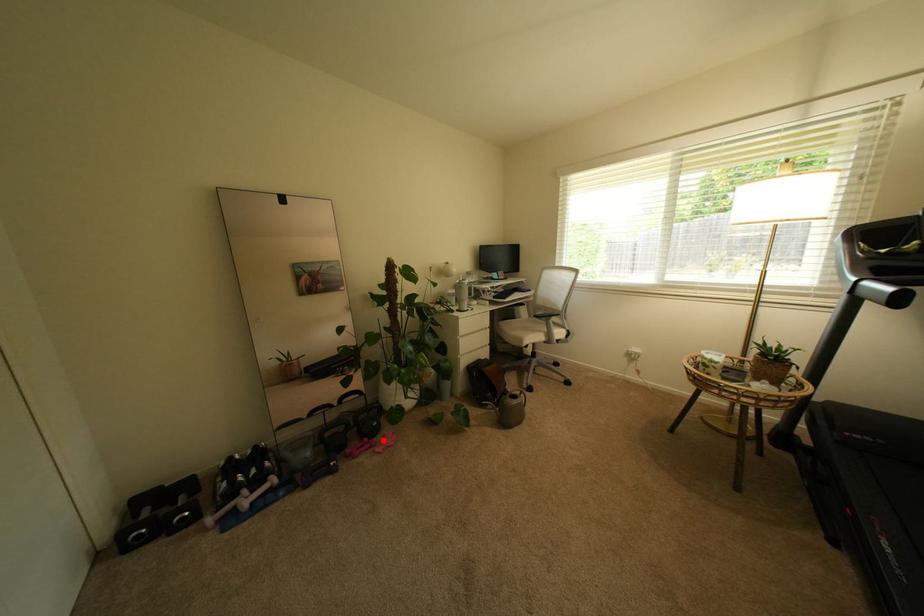
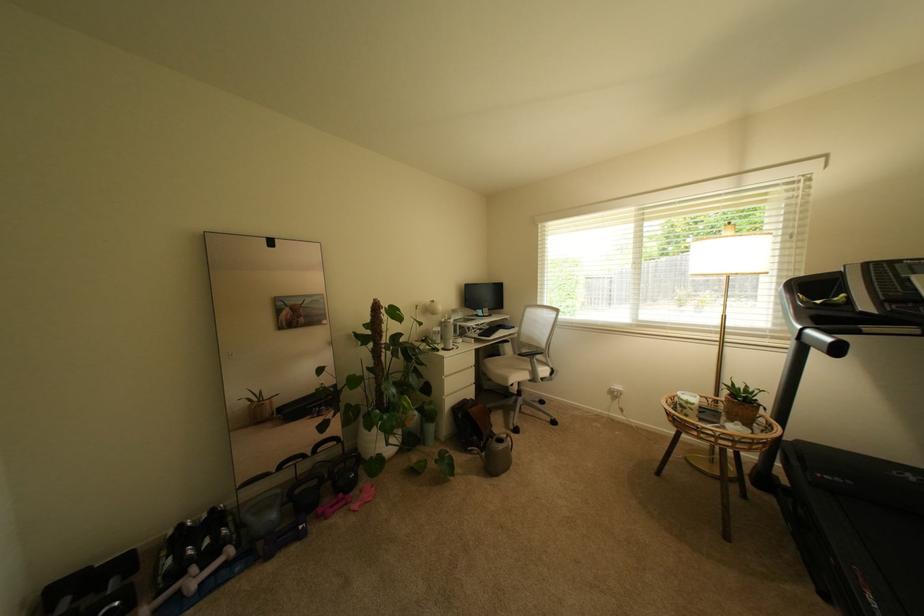
Find the pixel in the second image that matches the highlighted location in the first image.

(359, 495)